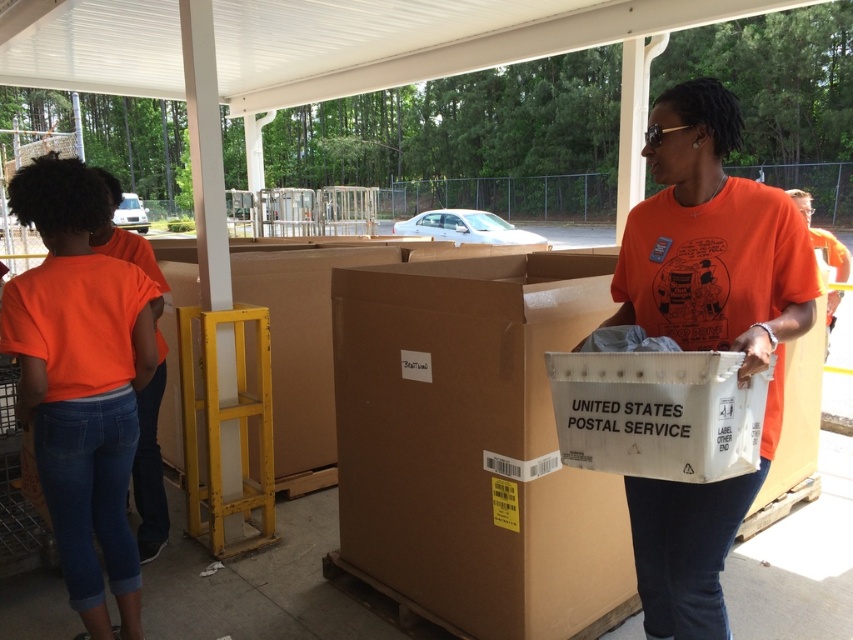
Question: Can you confirm if orange cotton shirt at left is bigger than white cardboard box at center?

Choices:
 (A) no
 (B) yes

Answer: (B)

Question: Estimate the real-world distances between objects in this image. Which object is farther from the white cardboard box at center?

Choices:
 (A) orange cotton shirt at center
 (B) orange cotton shirt at left

Answer: (B)

Question: Which point is closer to the camera?

Choices:
 (A) (672, 566)
 (B) (730, 364)
 (C) (62, 288)

Answer: (B)

Question: Where is orange cotton shirt at center located in relation to white cardboard box at center in the image?

Choices:
 (A) right
 (B) left

Answer: (A)

Question: Can you confirm if orange cotton shirt at center is thinner than white cardboard box at center?

Choices:
 (A) no
 (B) yes

Answer: (A)

Question: Estimate the real-world distances between objects in this image. Which object is closer to the white cardboard box at center?

Choices:
 (A) orange cotton shirt at center
 (B) orange cotton shirt at left

Answer: (A)